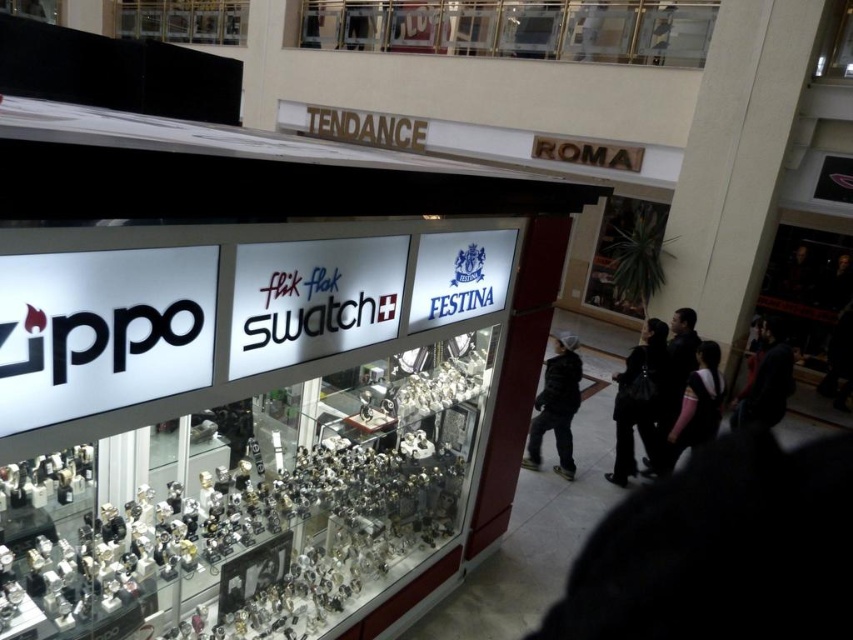
Question: Where is black fabric bag at lower right located in relation to black fuzzy jacket at center in the image?

Choices:
 (A) left
 (B) right

Answer: (B)

Question: Can you confirm if black fuzzy jacket at center is thinner than black fabric at lower right?

Choices:
 (A) yes
 (B) no

Answer: (B)

Question: Can you confirm if black fuzzy jacket at center is positioned to the right of black fabric at lower right?

Choices:
 (A) no
 (B) yes

Answer: (A)

Question: Which of the following is the farthest from the observer?

Choices:
 (A) black fabric bag at lower right
 (B) black fabric at lower right

Answer: (B)

Question: Among these points, which one is farthest from the camera?

Choices:
 (A) (660, 372)
 (B) (570, 433)

Answer: (B)

Question: Estimate the real-world distances between objects in this image. Which object is closer to the black fabric bag at lower right?

Choices:
 (A) black fabric at lower right
 (B) black fuzzy jacket at center

Answer: (B)